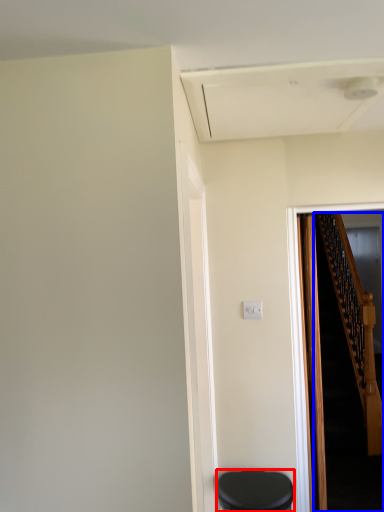
Question: Which of the following is the closest to the observer, furniture (highlighted by a red box) or stairs (highlighted by a blue box)?

Choices:
 (A) furniture
 (B) stairs

Answer: (A)